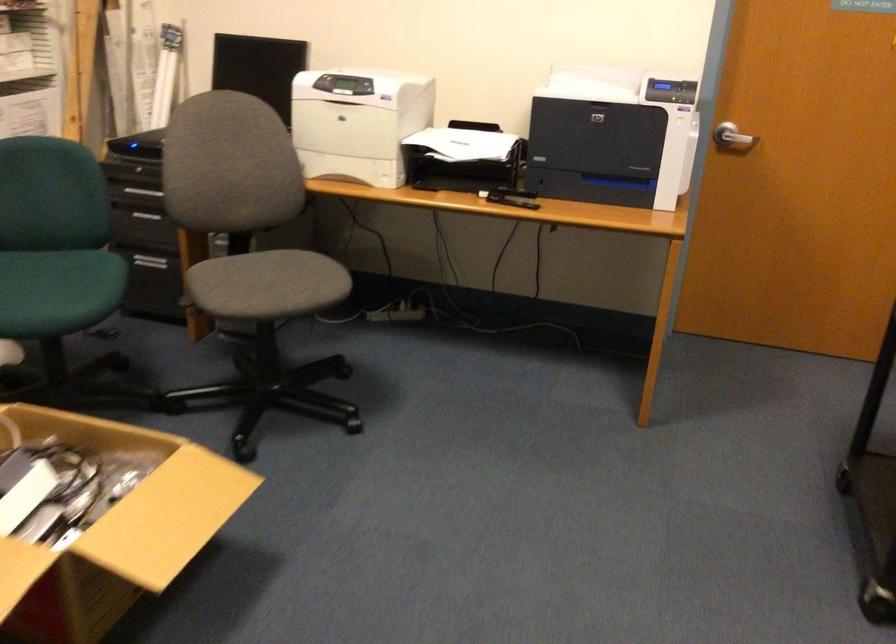
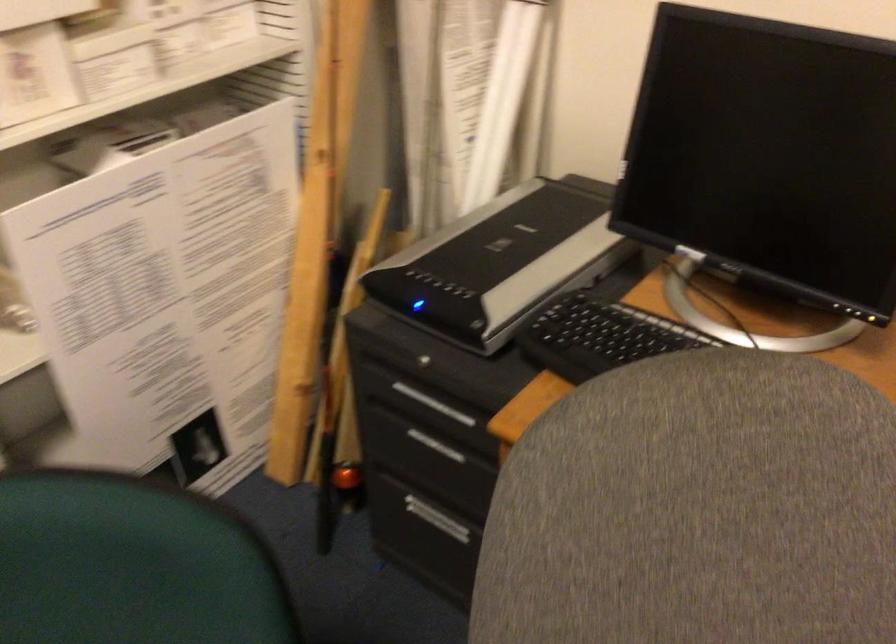
Looking at this image, the images are taken continuously from a first-person perspective. In which direction are you moving?

The movement direction of the cameraman is left, forward.